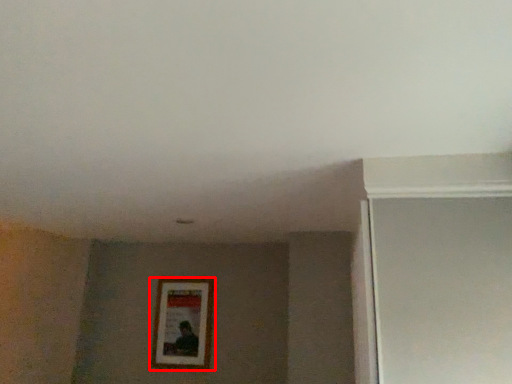
Question: From the image's perspective, considering the relative positions of picture frame (annotated by the red box) and screen door in the image provided, where is picture frame (annotated by the red box) located with respect to the staircase?

Choices:
 (A) above
 (B) below

Answer: (B)